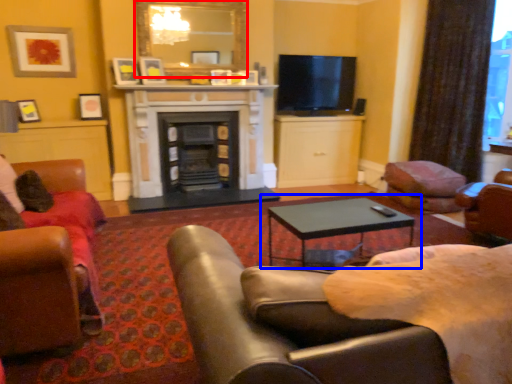
Question: Among these objects, which one is farthest to the camera, mirror (highlighted by a red box) or coffee table (highlighted by a blue box)?

Choices:
 (A) mirror
 (B) coffee table

Answer: (A)